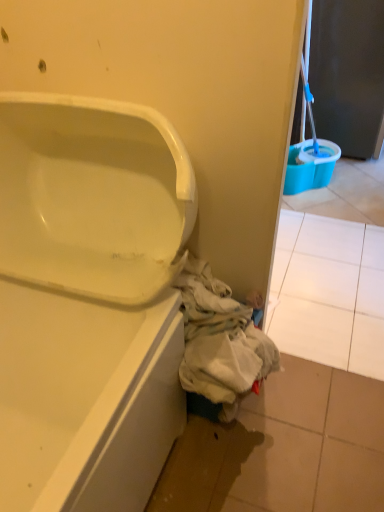
Question: Considering the positions of white tile at lower right and white glossy bathtub at lower left in the image, is white tile at lower right bigger or smaller than white glossy bathtub at lower left?

Choices:
 (A) big
 (B) small

Answer: (B)

Question: Relative to white glossy bathtub at lower left, is white tile at lower right in front or behind?

Choices:
 (A) behind
 (B) front

Answer: (A)

Question: Based on their relative distances, which object is farther from the matte black screen door at upper right?

Choices:
 (A) white tile at lower right
 (B) white glossy bathtub at lower left
 (C) white fabric at lower right

Answer: (B)

Question: Which of these objects is positioned closest to the white tile at lower right?

Choices:
 (A) white glossy bathtub at lower left
 (B) matte black screen door at upper right
 (C) white fabric at lower right

Answer: (C)